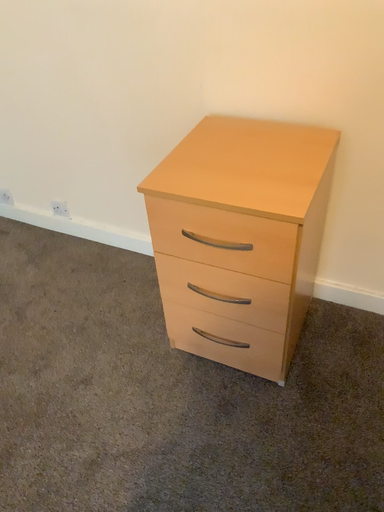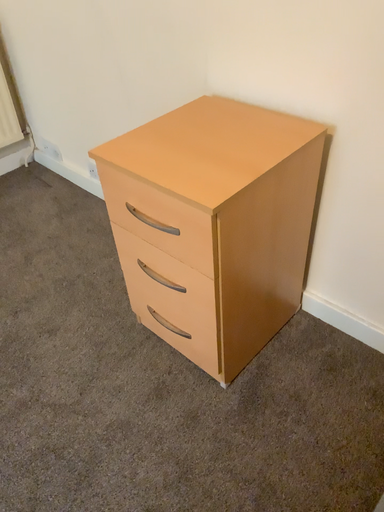
Question: Which way did the camera rotate in the video?

Choices:
 (A) rotated right
 (B) rotated left

Answer: (B)